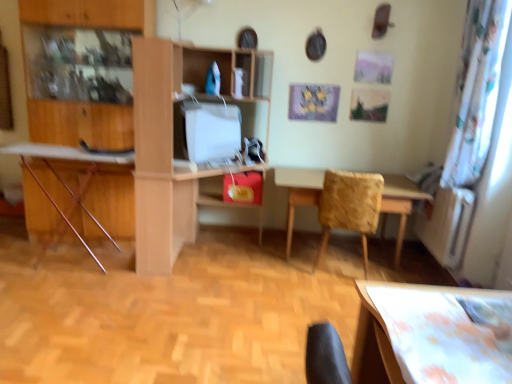
Question: In terms of width, does wooden ironing board at left look wider or thinner when compared to wooden textured table at center?

Choices:
 (A) thin
 (B) wide

Answer: (A)

Question: Relative to wooden textured table at center, is wooden ironing board at left in front or behind?

Choices:
 (A) front
 (B) behind

Answer: (A)

Question: Based on their relative distances, which object is nearer to the light wood/wooden desk at center?

Choices:
 (A) wooden chair at center
 (B) white glossy computer monitor at center
 (C) wooden dresser at left
 (D) wooden textured table at center
 (E) wooden ironing board at left

Answer: (B)

Question: Estimate the real-world distances between objects in this image. Which object is closer to the light wood/wooden desk at center?

Choices:
 (A) wooden textured table at center
 (B) wooden chair at center
 (C) wooden ironing board at left
 (D) white glossy computer monitor at center
 (E) wooden dresser at left

Answer: (D)